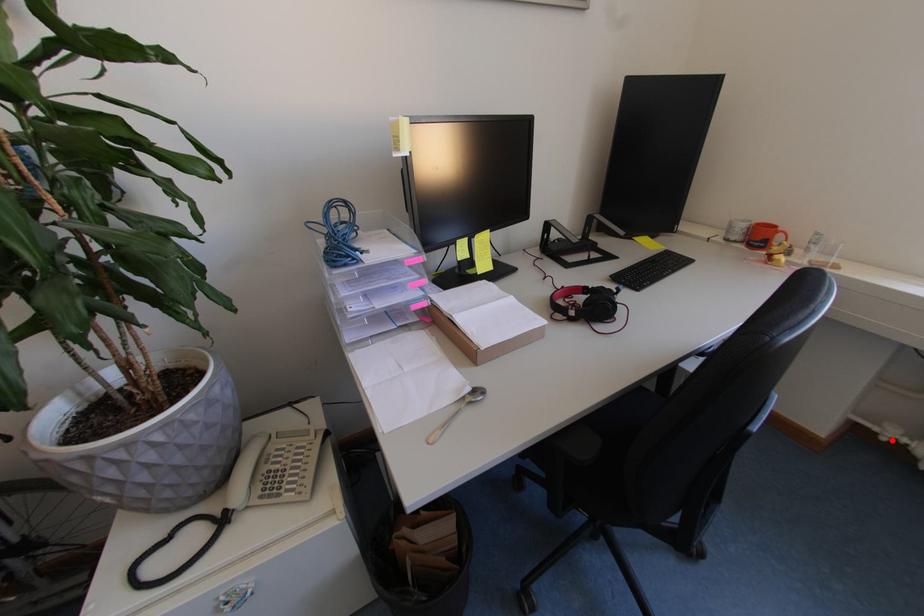
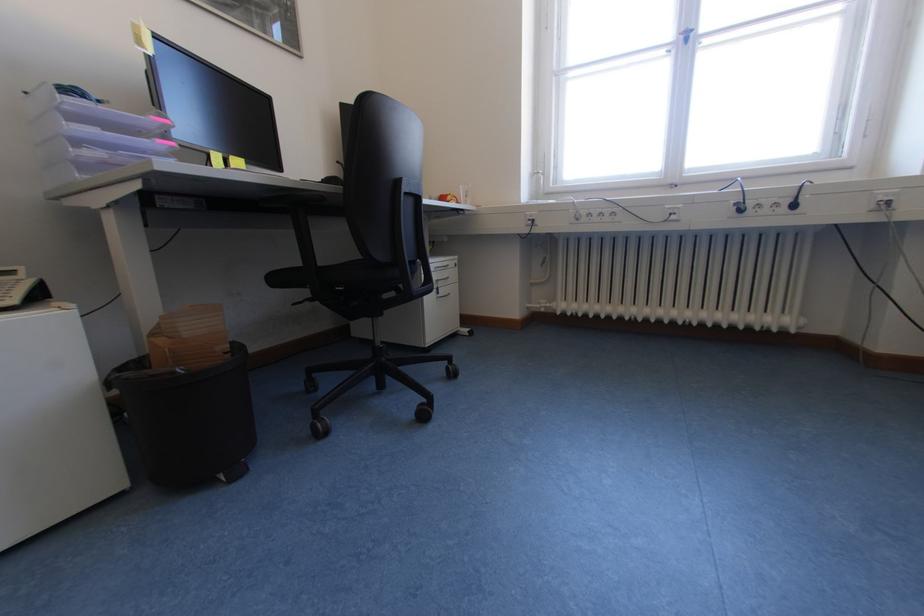
Question: I am providing you with two images of the same scene from different viewpoints. Given a red point in image1, look at the same physical point in image2. Is it:

Choices:
 (A) Closer to the viewpoint
 (B) Farther from the viewpoint

Answer: (A)